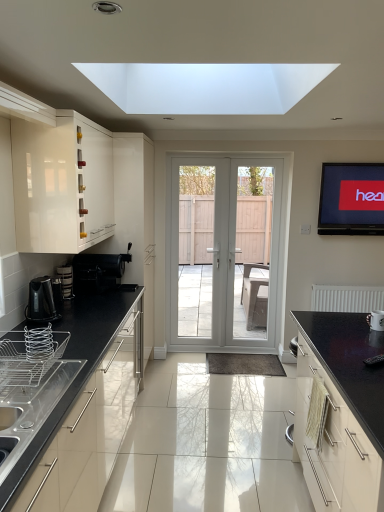
Locate an element on the screen. The image size is (384, 512). free spot below matte black tv at upper right (from a real-world perspective) is located at coordinates (355, 281).